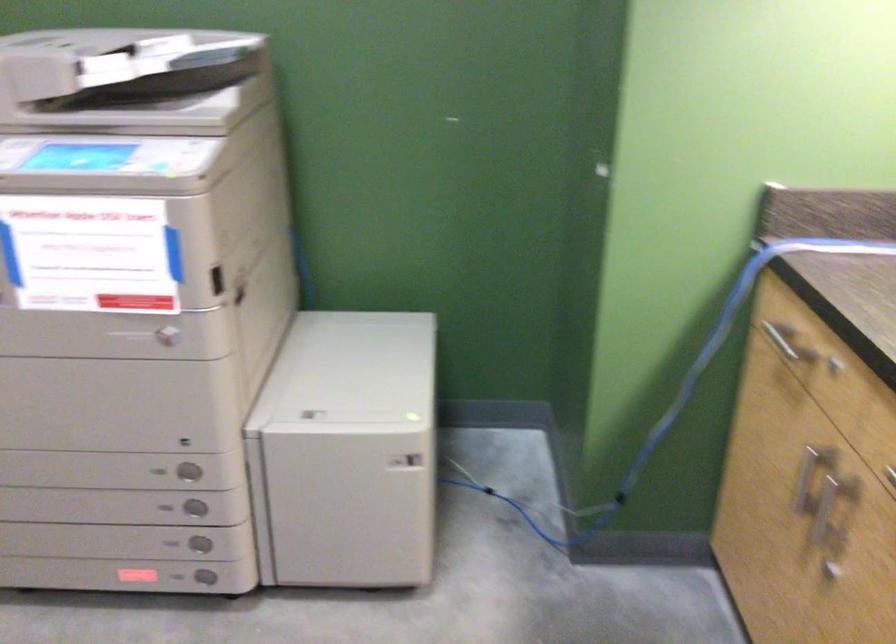
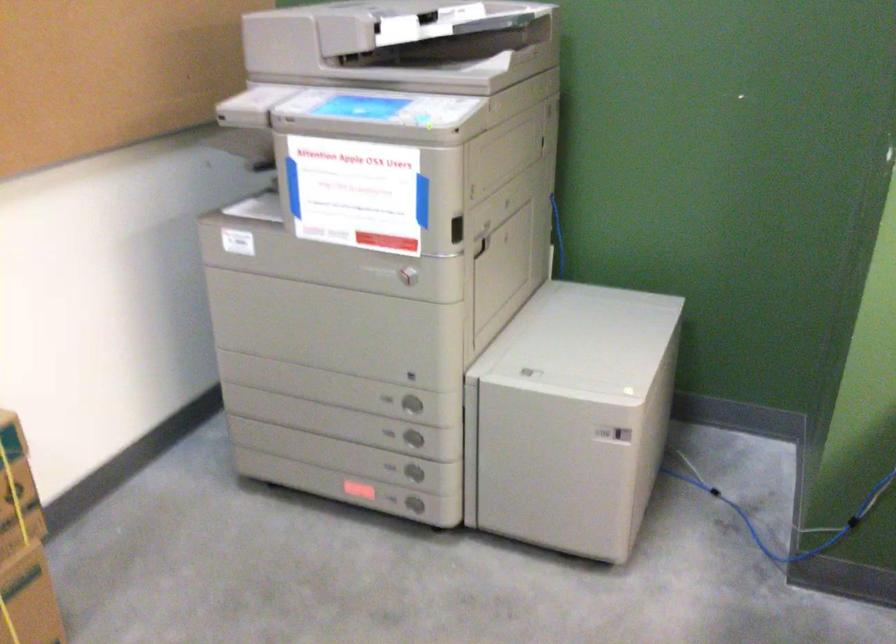
The point at (x=192, y=474) is marked in the first image. Where is the corresponding point in the second image?

(411, 404)